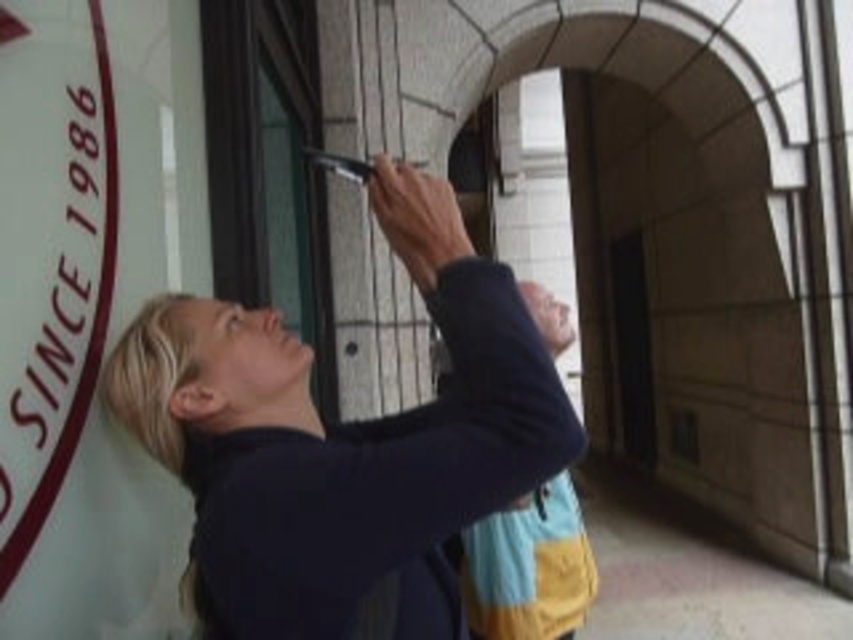
What do you see at coordinates (343, 442) in the screenshot? I see `matte black phone at upper center` at bounding box center [343, 442].

Is matte black phone at upper center taller than white matte sign at upper left?

Incorrect, matte black phone at upper center's height is not larger of white matte sign at upper left's.

Identify the location of matte black phone at upper center. Image resolution: width=853 pixels, height=640 pixels. click(x=343, y=442).

Identify the location of matte black phone at upper center. click(343, 442).